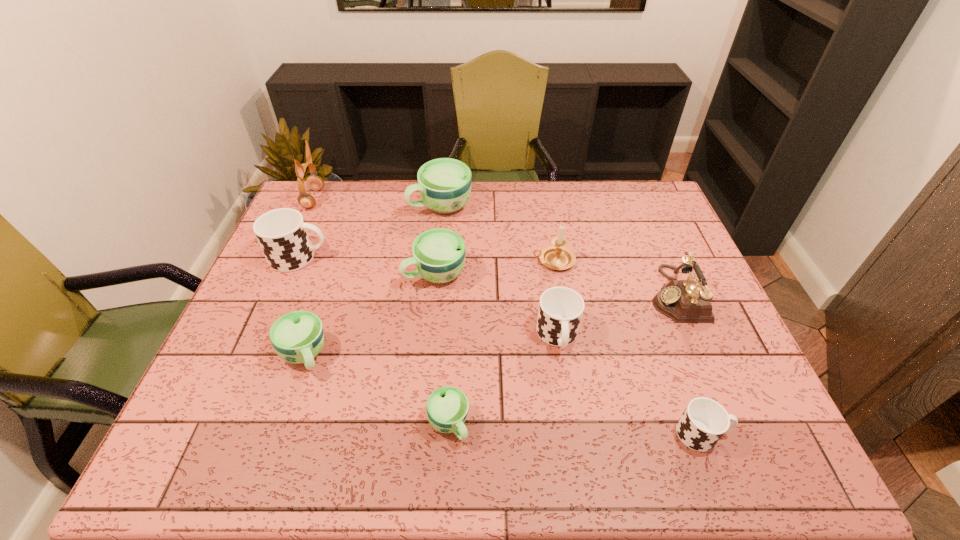
At what (x,y) coordinates should I click in order to perform the action: click on the sixth cup from left to right. Please return your answer as a coordinate pair (x, y). This screenshot has height=540, width=960. Looking at the image, I should click on (560, 311).

Find the location of a particular element. This screenshot has width=960, height=540. the second nearest blue cup is located at coordinates (297, 337).

Identify the location of the third biggest blue cup. (297, 337).

This screenshot has width=960, height=540. I want to click on the rightmost cup, so click(x=704, y=421).

The width and height of the screenshot is (960, 540). What are the coordinates of `the nearest black cup` in the screenshot? It's located at (704, 421).

Where is `the smallest blue cup`? The image size is (960, 540). the smallest blue cup is located at coordinates (447, 407).

Locate an element on the screen. the shortest cup is located at coordinates pos(447,407).

Locate an element on the screen. This screenshot has height=540, width=960. vacant region located on the front-facing side of the brown earphone is located at coordinates (402, 199).

Find the location of a particular element. Image resolution: width=960 pixels, height=540 pixels. vacant space located on the right of the biggest blue cup is located at coordinates (564, 206).

Where is `blank space located with a handle on the side of the beige candle holder`? The height and width of the screenshot is (540, 960). blank space located with a handle on the side of the beige candle holder is located at coordinates (x=422, y=261).